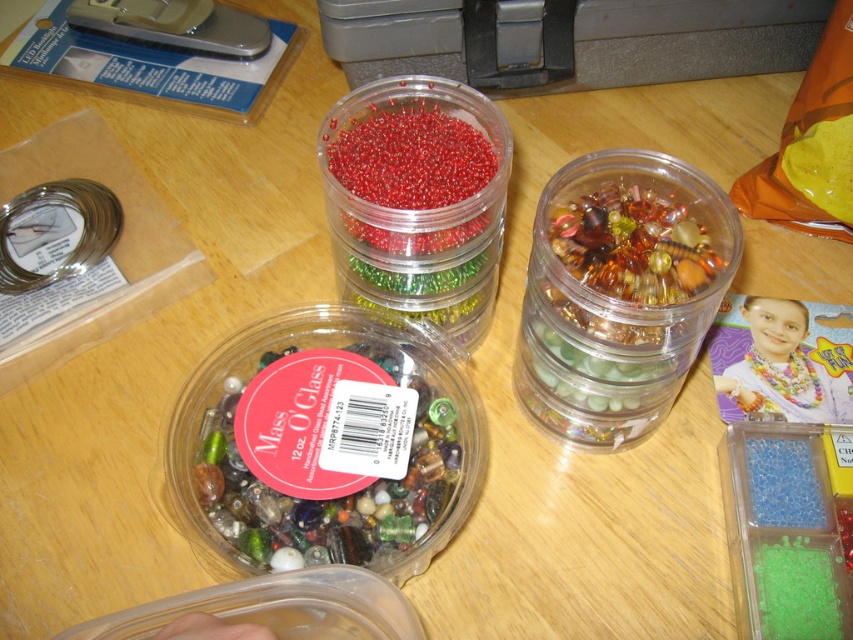
Question: Where is translucent plastic beads at upper right located in relation to blue translucent beads at lower right in the image?

Choices:
 (A) below
 (B) above

Answer: (B)

Question: Among these points, which one is nearest to the camera?

Choices:
 (A) (486, 147)
 (B) (753, 518)
 (C) (589, 154)

Answer: (C)

Question: Estimate the real-world distances between objects in this image. Which object is closer to the translucent plastic beads at upper right?

Choices:
 (A) red translucent beads at center
 (B) blue translucent beads at lower right

Answer: (A)

Question: Does translucent plastic beads at upper right appear under blue translucent beads at lower right?

Choices:
 (A) no
 (B) yes

Answer: (A)

Question: Which object is closer to the camera taking this photo?

Choices:
 (A) red translucent beads at center
 (B) translucent plastic beads at upper right

Answer: (B)

Question: Does translucent plastic beads at upper right appear on the left side of blue translucent beads at lower right?

Choices:
 (A) yes
 (B) no

Answer: (A)